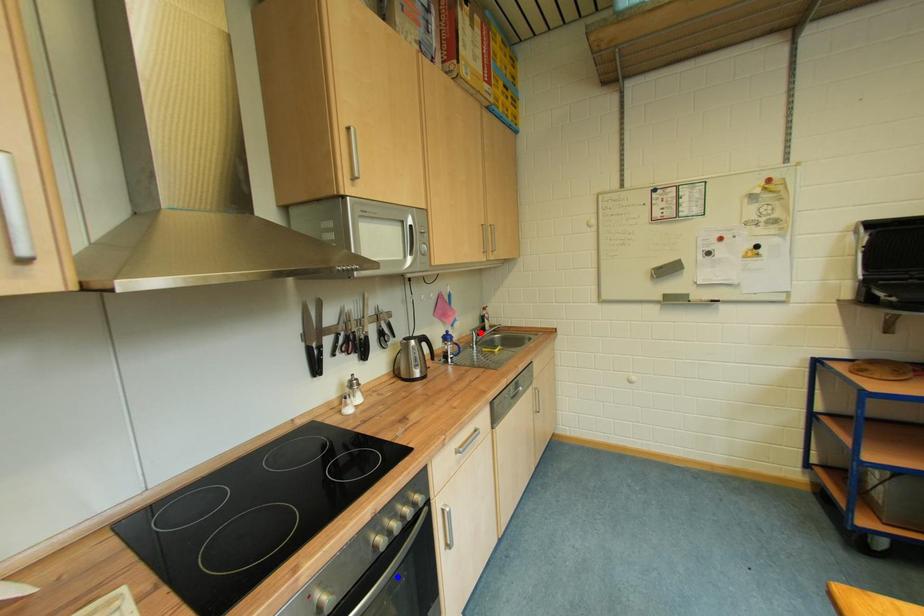
Question: In the image, two points are highlighted. Which point is nearer to the camera? Reply with the corresponding letter.

Choices:
 (A) blue point
 (B) red point

Answer: (A)